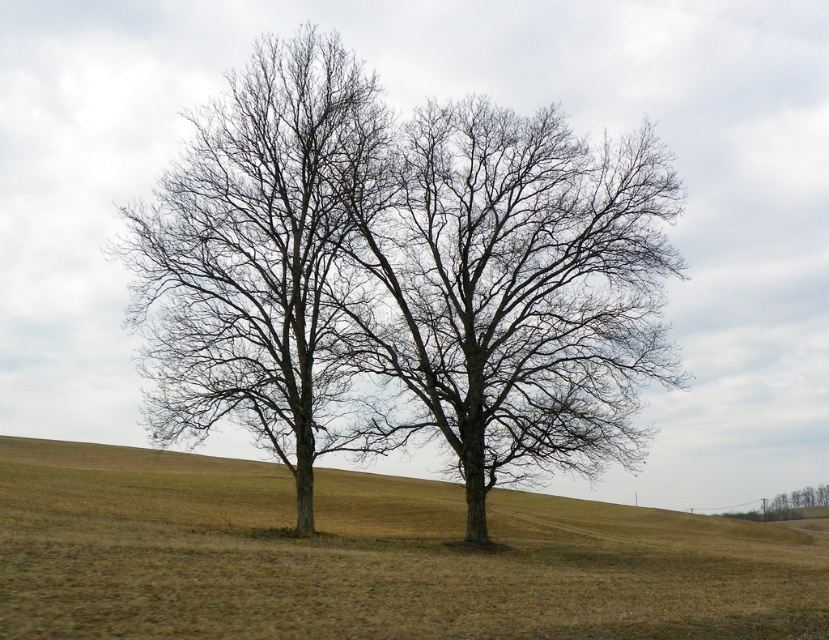
Question: Does bare wood tree at center have a larger size compared to brown leafless tree at lower right?

Choices:
 (A) yes
 (B) no

Answer: (A)

Question: Does brown grassy hillside at center have a larger size compared to bare wood tree at center?

Choices:
 (A) yes
 (B) no

Answer: (A)

Question: Can you confirm if brown grassy hillside at center is wider than brown leafless tree at lower right?

Choices:
 (A) yes
 (B) no

Answer: (A)

Question: Among these points, which one is farthest from the camera?

Choices:
 (A) (178, 509)
 (B) (168, 422)
 (C) (720, 515)
 (D) (356, 157)

Answer: (C)

Question: Which object is farther from the camera taking this photo?

Choices:
 (A) bare branches at center
 (B) brown grassy hillside at center
 (C) brown leafless tree at lower right

Answer: (C)

Question: Which of the following is the closest to the observer?

Choices:
 (A) (x=800, y=500)
 (B) (x=789, y=577)

Answer: (B)